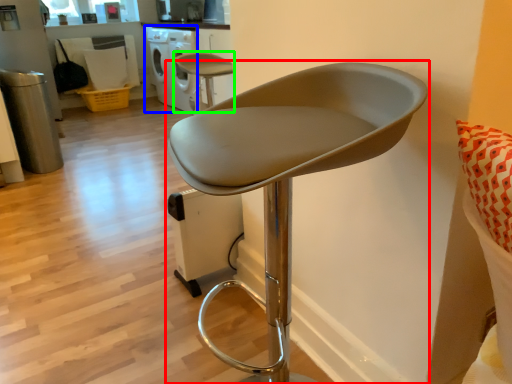
Question: Considering the real-world distances, which object is closest to chair (highlighted by a red box)? dish washer (highlighted by a blue box) or chair (highlighted by a green box).

Choices:
 (A) dish washer
 (B) chair

Answer: (B)